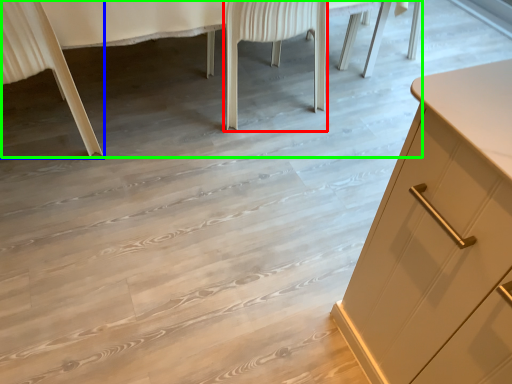
Question: Based on their relative distances, which object is nearer to chair (highlighted by a red box)? Choose from chair (highlighted by a blue box) and vanity (highlighted by a green box).

Choices:
 (A) chair
 (B) vanity

Answer: (B)